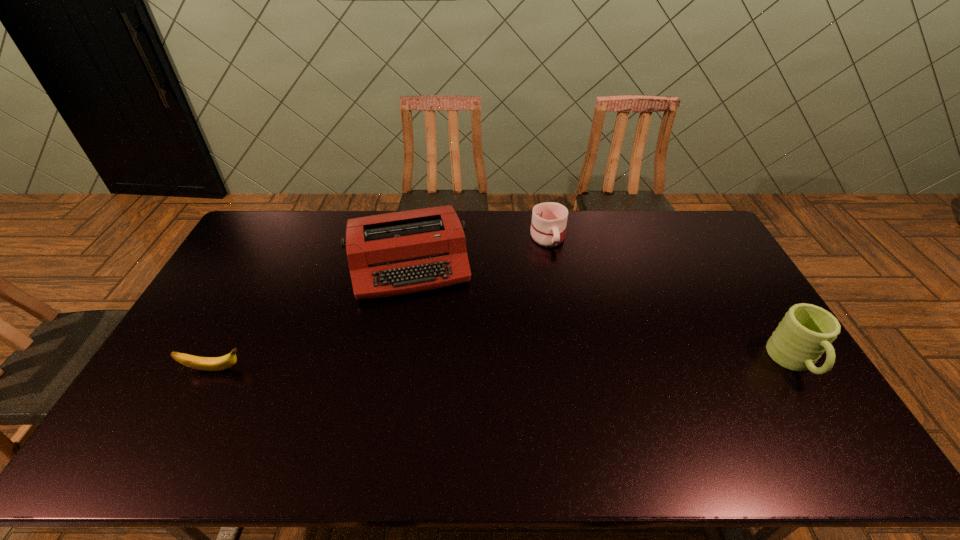
Locate an element on the screen. banana is located at coordinates (201, 363).

Locate an element on the screen. the shortest object is located at coordinates coord(201,363).

The height and width of the screenshot is (540, 960). Find the location of `the nearer mug`. the nearer mug is located at coordinates (806, 331).

I want to click on the right mug, so click(806, 331).

The image size is (960, 540). Find the location of `typewriter`. typewriter is located at coordinates (391, 254).

Where is `the farther mug`? This screenshot has height=540, width=960. the farther mug is located at coordinates (549, 219).

I want to click on the shorter mug, so click(x=549, y=219).

Identify the location of vacant space situated at the stem of the banana. (301, 369).

What are the coordinates of `vacant area situated on the typing side of the typewriter` in the screenshot? It's located at (426, 338).

The width and height of the screenshot is (960, 540). In order to click on blank space located 0.200m on the typing side of the typewriter in this screenshot , I will do `click(429, 352)`.